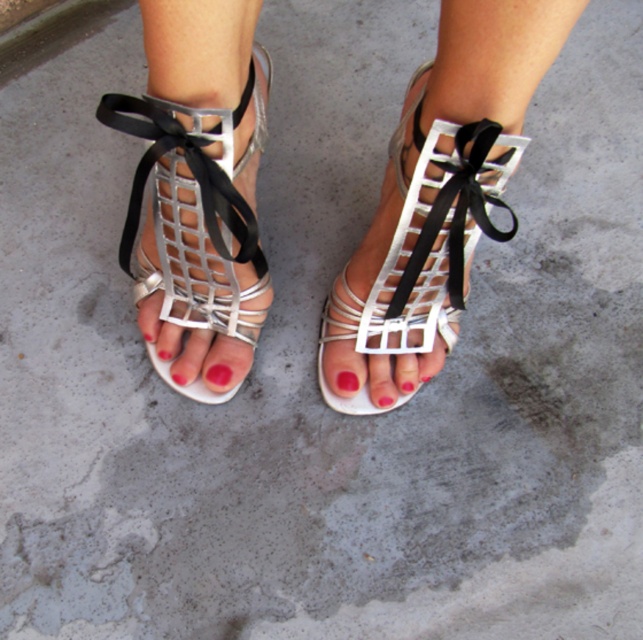
Question: Is matte black toe at center positioned at the back of matte white nail polish at center?

Choices:
 (A) no
 (B) yes

Answer: (B)

Question: Which point appears closest to the camera in this image?

Choices:
 (A) (228, 189)
 (B) (449, 312)
 (C) (177, 337)

Answer: (A)

Question: Which point is farther from the camera taking this photo?

Choices:
 (A) (340, 376)
 (B) (390, 348)

Answer: (A)

Question: Considering the real-world distances, which object is closest to the matte white nail polish at center?

Choices:
 (A) matte pink nail polish at center
 (B) metallic silver sandal at left
 (C) metallic silver sandal at center

Answer: (B)

Question: Can you confirm if metallic silver sandal at left is smaller than metallic silver sandal at center?

Choices:
 (A) no
 (B) yes

Answer: (B)

Question: Does metallic silver sandal at center appear on the left side of matte pink nail polish at center?

Choices:
 (A) no
 (B) yes

Answer: (A)